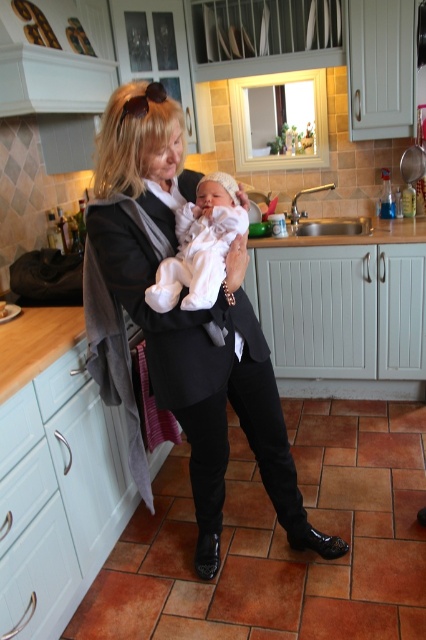
Does black smooth business suit at center appear under white soft fabric newborn at center?

Yes.

Is point (147, 352) closer to viewer compared to point (224, 237)?

No, (147, 352) is behind (224, 237).

At what (x,y) coordinates should I click in order to perform the action: click on black smooth business suit at center. Please return your answer as a coordinate pair (x, y). Looking at the image, I should click on (201, 372).